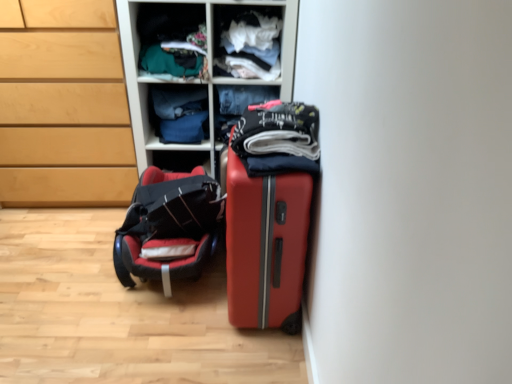
Question: From a real-world perspective, is matte green fabric at upper center, the third clothing from the front, located higher than white cotton shirt at upper center, which is the fourth clothing in back-to-front order?

Choices:
 (A) yes
 (B) no

Answer: (B)

Question: Considering the relative positions of matte green fabric at upper center, the 3th clothing from the back, and white cotton shirt at upper center, the second clothing when ordered from front to back, in the image provided, is matte green fabric at upper center, the 3th clothing from the back, behind white cotton shirt at upper center, the second clothing when ordered from front to back,?

Choices:
 (A) yes
 (B) no

Answer: (A)

Question: Is matte green fabric at upper center, the 3th clothing from the back, taller than white cotton shirt at upper center, which is the fourth clothing in back-to-front order?

Choices:
 (A) no
 (B) yes

Answer: (A)

Question: Are matte green fabric at upper center, the 3th clothing from the back, and white cotton shirt at upper center, the second clothing when ordered from front to back, far apart?

Choices:
 (A) yes
 (B) no

Answer: (B)

Question: Considering the relative positions of matte green fabric at upper center, the third clothing from the front, and white cotton shirt at upper center, which is the fourth clothing in back-to-front order, in the image provided, is matte green fabric at upper center, the third clothing from the front, to the right of white cotton shirt at upper center, which is the fourth clothing in back-to-front order, from the viewer's perspective?

Choices:
 (A) no
 (B) yes

Answer: (A)

Question: From their relative heights in the image, would you say matte plastic shelves at upper center is taller or shorter than denim jeans at center, marked as the second clothing in a back-to-front arrangement?

Choices:
 (A) tall
 (B) short

Answer: (A)

Question: Considering their positions, is matte plastic shelves at upper center located in front of or behind denim jeans at center, positioned as the fourth clothing in front-to-back order?

Choices:
 (A) front
 (B) behind

Answer: (A)

Question: Visually, is matte plastic shelves at upper center positioned to the left or to the right of denim jeans at center, marked as the second clothing in a back-to-front arrangement?

Choices:
 (A) right
 (B) left

Answer: (B)

Question: Is matte plastic shelves at upper center inside or outside of denim jeans at center, marked as the second clothing in a back-to-front arrangement?

Choices:
 (A) inside
 (B) outside

Answer: (B)

Question: From a real-world perspective, is denim jeans at center, marked as the 1th clothing in a back-to-front arrangement, above or below black leather baby car seat at lower left?

Choices:
 (A) below
 (B) above

Answer: (B)

Question: Would you say denim jeans at center, marked as the 1th clothing in a back-to-front arrangement, is inside or outside black leather baby car seat at lower left?

Choices:
 (A) inside
 (B) outside

Answer: (B)

Question: Is denim jeans at center, positioned as the 5th clothing in front-to-back order, in front of or behind black leather baby car seat at lower left in the image?

Choices:
 (A) behind
 (B) front

Answer: (A)

Question: In terms of width, does denim jeans at center, positioned as the 5th clothing in front-to-back order, look wider or thinner when compared to black leather baby car seat at lower left?

Choices:
 (A) thin
 (B) wide

Answer: (A)

Question: Based on their positions, is denim jeans at center, marked as the 1th clothing in a back-to-front arrangement, located to the left or right of dark gray cotton shirt at center, the 5th clothing from the back?

Choices:
 (A) left
 (B) right

Answer: (A)

Question: From the image's perspective, is denim jeans at center, positioned as the 5th clothing in front-to-back order, above or below dark gray cotton shirt at center, which is counted as the 1th clothing, starting from the front?

Choices:
 (A) above
 (B) below

Answer: (A)